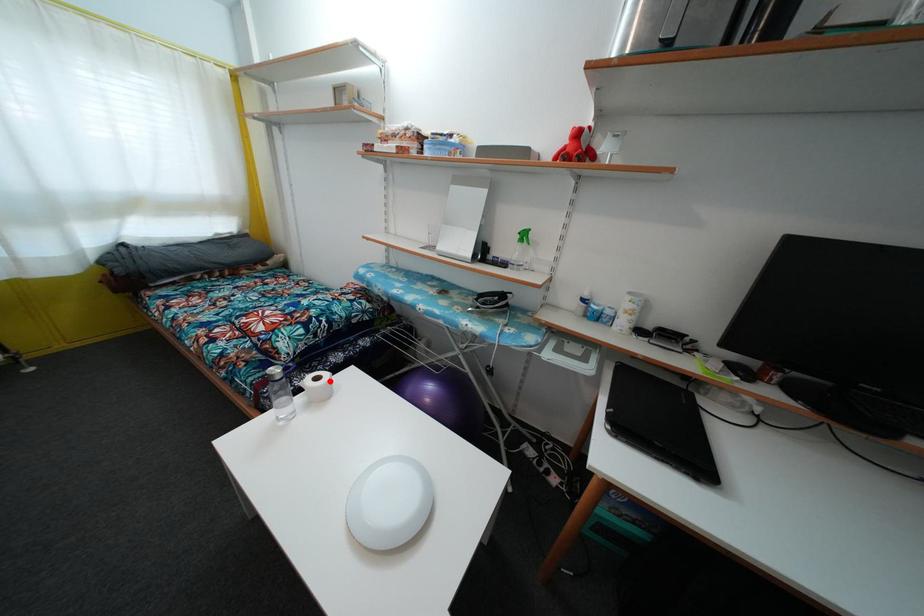
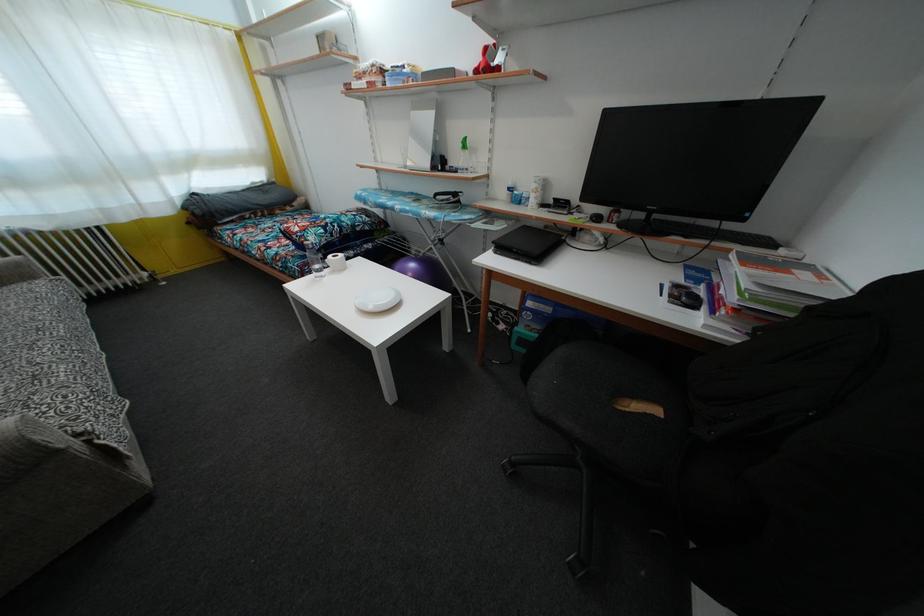
In the second image, find the point that corresponds to the highlighted location in the first image.

(345, 262)